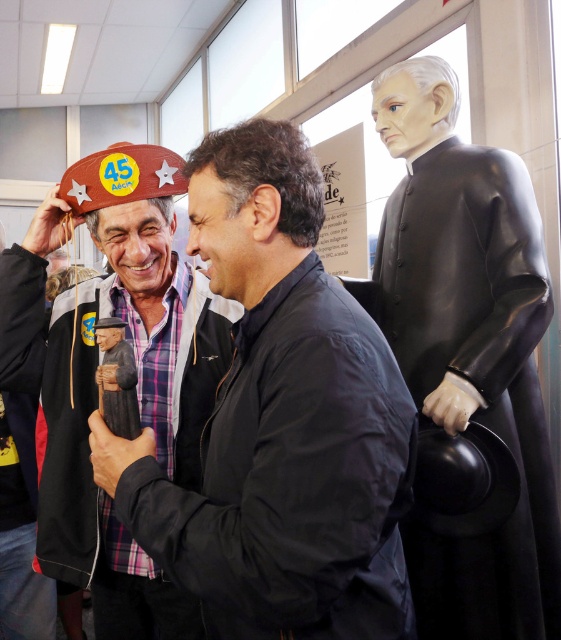
You are standing in the museum and want to walk from point (512, 556) to point (49, 452). Which direction should you move relative to your current position?

You should move diagonally downward and to the left because point (49, 452) is closer to the viewer than point (512, 556), so it is located below and to the left in the image.

You are an interior designer assessing the layout of this space. You notice the matte brown hat at left and the black glossy statue at right. Based on their positions, which object is closer to the viewer?

The matte brown hat at left is closer to the viewer because it is in front of the black glossy statue at right.